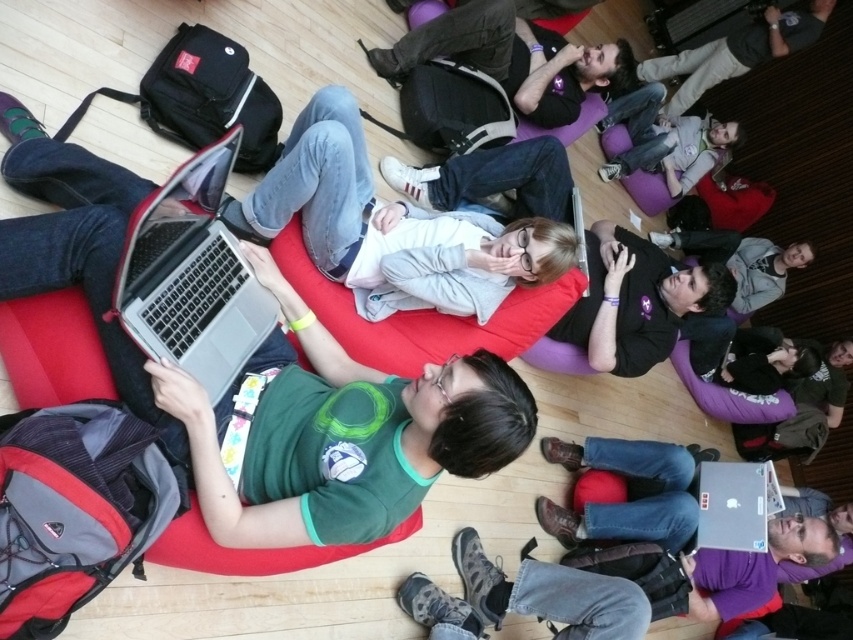
Question: Which object is the closest to the silver metallic laptop at center?

Choices:
 (A) matte black laptop at upper center
 (B) dark gray fabric jacket at upper right
 (C) matte gray sweater at center

Answer: (C)

Question: Among these objects, which one is nearest to the camera?

Choices:
 (A) matte black laptop at upper center
 (B) matte gray sweater at center
 (C) silver metallic laptop at center
 (D) dark gray fabric jacket at upper right

Answer: (C)

Question: Does matte gray sweater at center lie behind dark gray fabric jacket at upper right?

Choices:
 (A) yes
 (B) no

Answer: (B)

Question: Is matte black laptop at upper center positioned in front of dark gray fabric jacket at upper right?

Choices:
 (A) yes
 (B) no

Answer: (A)

Question: Which point is farther from the camera taking this photo?

Choices:
 (A) (515, 22)
 (B) (804, 26)
 (C) (166, 211)

Answer: (B)

Question: In this image, where is matte black laptop at upper center located relative to dark gray fabric jacket at upper right?

Choices:
 (A) right
 (B) left

Answer: (B)